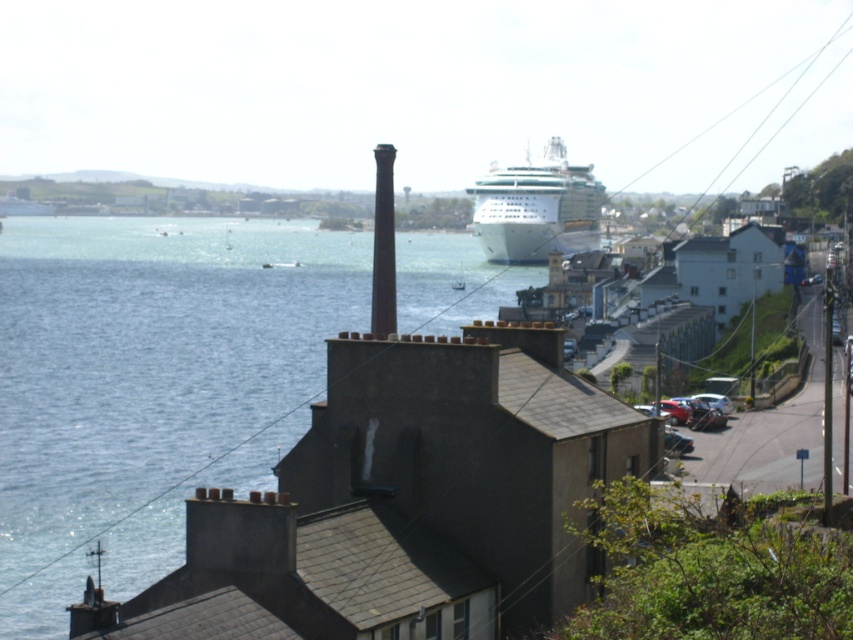
You are standing on the dock and see the blue water at center and the white glossy cruise ship at center. Which object is positioned to the left of the other?

The blue water at center is to the left of the white glossy cruise ship at center according to the description.

You are standing on the dock and looking at the blue water at center and the white glossy cruise ship at center. Which object is positioned lower in the scene?

The blue water at center is located below the white glossy cruise ship at center, so it is positioned lower in the scene.